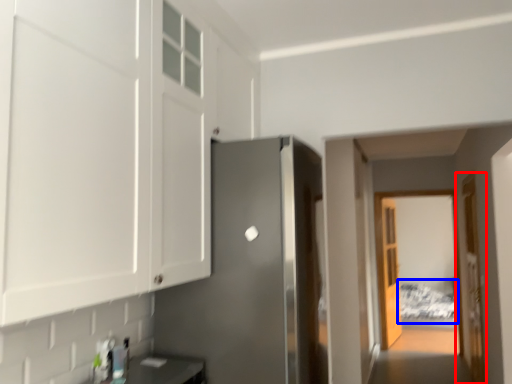
Question: Among these objects, which one is farthest to the camera, door (highlighted by a red box) or bed (highlighted by a blue box)?

Choices:
 (A) door
 (B) bed

Answer: (B)